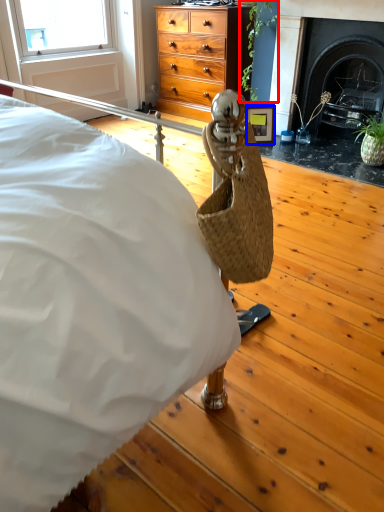
Question: Which of the following is the farthest to the observer, plant (highlighted by a red box) or picture frame (highlighted by a blue box)?

Choices:
 (A) plant
 (B) picture frame

Answer: (B)